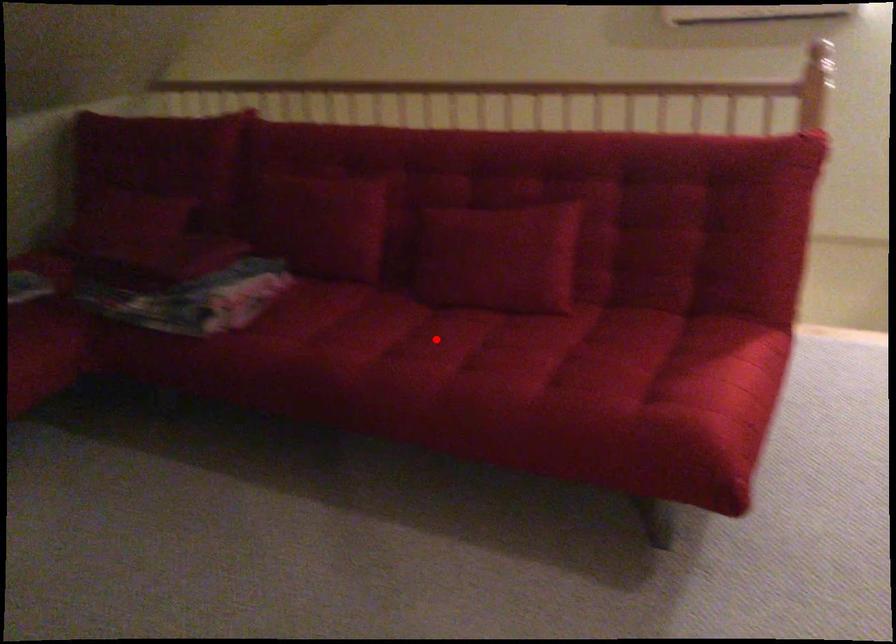
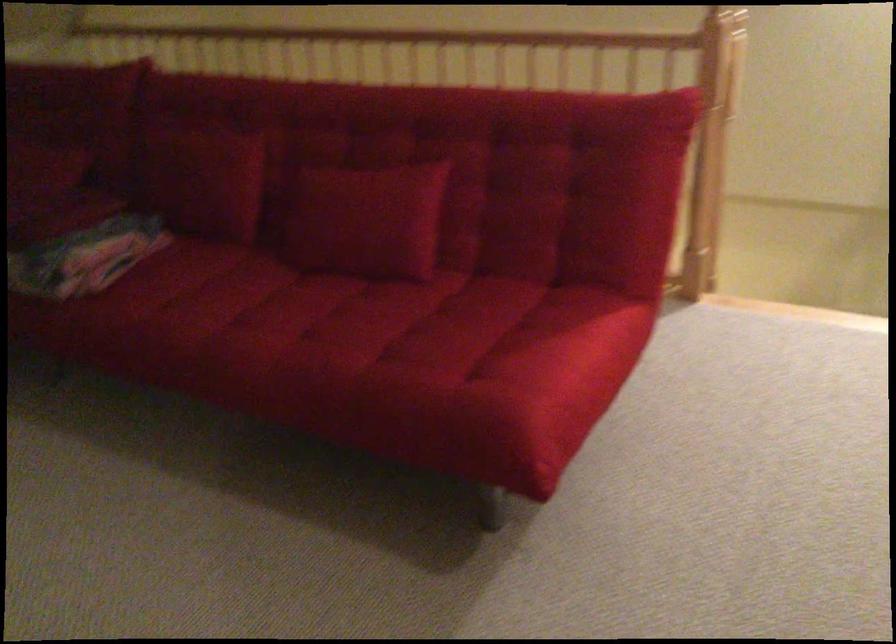
The point at the highlighted location is marked in the first image. Where is the corresponding point in the second image?

(290, 310)